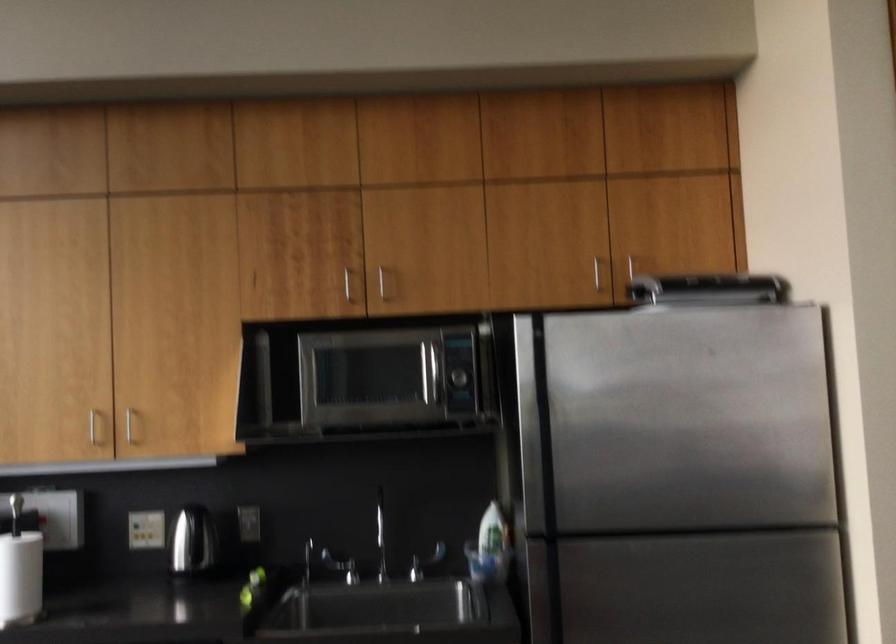
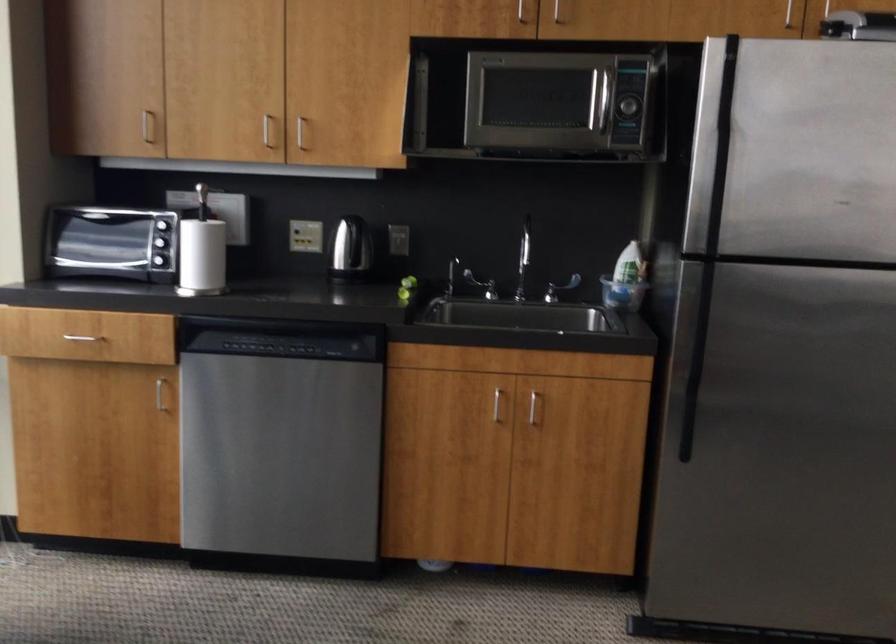
The point at (131, 426) is marked in the first image. Where is the corresponding point in the second image?

(300, 131)